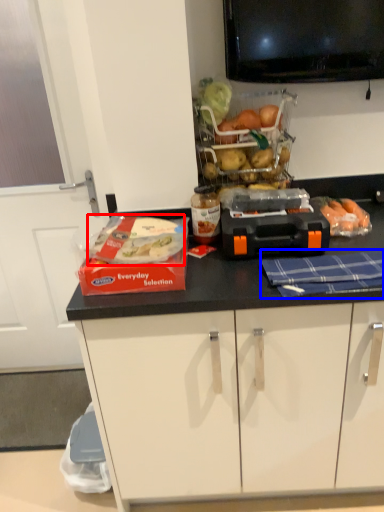
Question: Which of the following is the farthest to the observer, food (highlighted by a red box) or blanket (highlighted by a blue box)?

Choices:
 (A) food
 (B) blanket

Answer: (A)